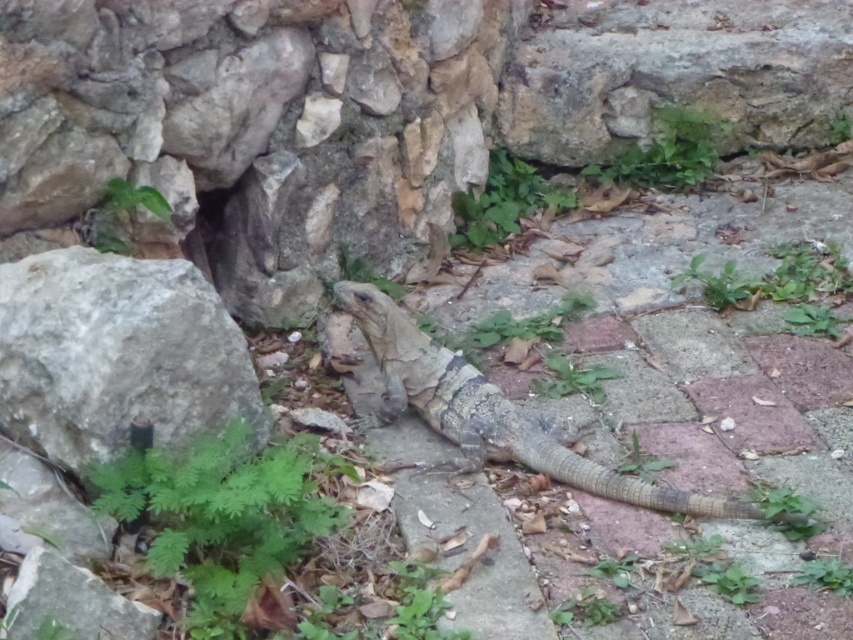
You are a geologist examining the stone wall in the background. You notice a point at coordinates (x=688, y=400). What is located at this point?

At point (x=688, y=400) lies leathery brown iguana at center.

You are a wildlife photographer aiming to capture both the leathery brown iguana at center and the leathery brown lizard at center in a single frame. Considering their sizes, which one might require you to adjust your camera settings to ensure it appears clearly in the photo?

The leathery brown iguana at center is larger than the leathery brown lizard at center, so you might need to adjust your camera settings to focus on the larger iguana to ensure it appears clearly in the photo.

You are a wildlife photographer trying to capture both the leathery brown iguana at center and the leathery brown lizard at center in the same frame. Since you want to ensure both are visible, which one should you focus on first to account for their size difference?

The leathery brown iguana at center is taller than the leathery brown lizard at center, so you should focus on the leathery brown iguana at center first to ensure its full height is captured in the frame.